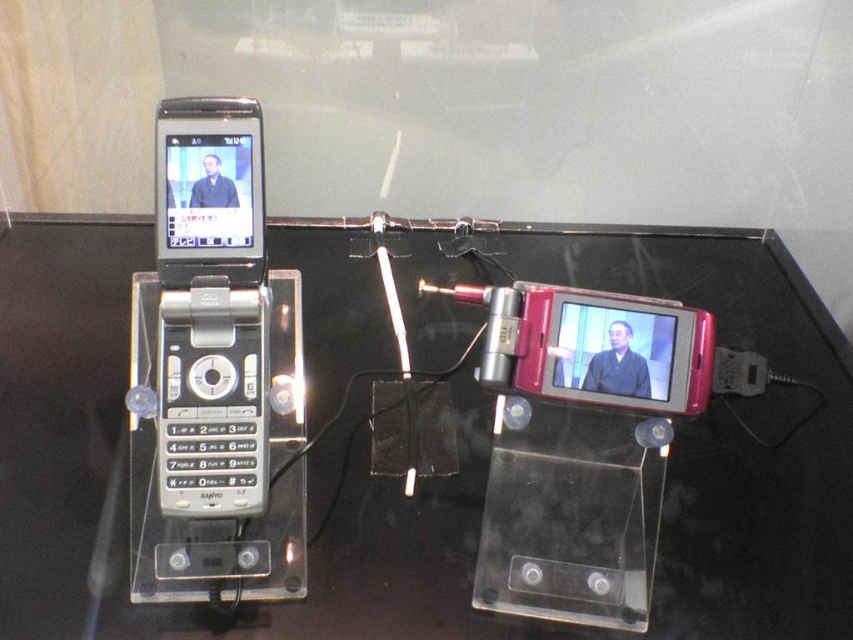
Question: Which object is closer to the camera taking this photo?

Choices:
 (A) black glossy glass table at center
 (B) matte black flip phone at left

Answer: (B)

Question: Can you confirm if black glossy glass table at center is positioned above matte black flip phone at left?

Choices:
 (A) no
 (B) yes

Answer: (A)

Question: Which object is closer to the camera taking this photo?

Choices:
 (A) matte black flip phone at left
 (B) black glossy glass table at center

Answer: (A)

Question: Can you confirm if black glossy glass table at center is thinner than matte black flip phone at left?

Choices:
 (A) yes
 (B) no

Answer: (B)

Question: In this image, where is black glossy glass table at center located relative to matte black flip phone at left?

Choices:
 (A) right
 (B) left

Answer: (A)